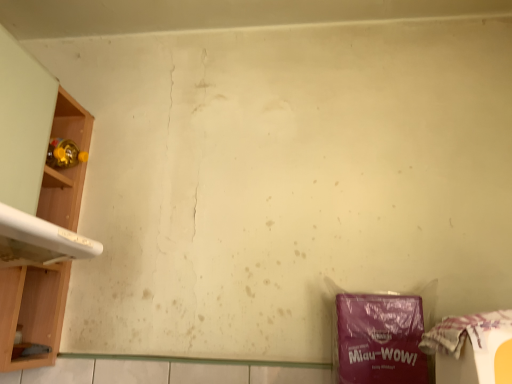
Question: Can you confirm if purple matte plastic bag at lower right is thinner than wooden shelf at left?

Choices:
 (A) no
 (B) yes

Answer: (B)

Question: Considering the relative positions of purple matte plastic bag at lower right and wooden shelf at left in the image provided, is purple matte plastic bag at lower right in front of wooden shelf at left?

Choices:
 (A) yes
 (B) no

Answer: (A)

Question: From a real-world perspective, is purple matte plastic bag at lower right below wooden shelf at left?

Choices:
 (A) no
 (B) yes

Answer: (B)

Question: From a real-world perspective, is purple matte plastic bag at lower right physically above wooden shelf at left?

Choices:
 (A) yes
 (B) no

Answer: (B)

Question: Is purple matte plastic bag at lower right oriented towards wooden shelf at left?

Choices:
 (A) no
 (B) yes

Answer: (A)

Question: Does purple matte plastic bag at lower right come behind wooden shelf at left?

Choices:
 (A) no
 (B) yes

Answer: (A)

Question: Is white glossy washing machine at left oriented towards purple matte plastic bag at lower right?

Choices:
 (A) yes
 (B) no

Answer: (A)

Question: From a real-world perspective, is white glossy washing machine at left positioned under purple matte plastic bag at lower right based on gravity?

Choices:
 (A) yes
 (B) no

Answer: (B)

Question: Does white glossy washing machine at left have a lesser width compared to purple matte plastic bag at lower right?

Choices:
 (A) no
 (B) yes

Answer: (A)

Question: Is white glossy washing machine at left to the left of purple matte plastic bag at lower right from the viewer's perspective?

Choices:
 (A) yes
 (B) no

Answer: (A)

Question: Considering the relative sizes of white glossy washing machine at left and purple matte plastic bag at lower right in the image provided, is white glossy washing machine at left smaller than purple matte plastic bag at lower right?

Choices:
 (A) yes
 (B) no

Answer: (B)

Question: Is white glossy washing machine at left at the right side of purple matte plastic bag at lower right?

Choices:
 (A) no
 (B) yes

Answer: (A)

Question: Considering the relative sizes of white glossy washing machine at left and plastic bag at lower right in the image provided, is white glossy washing machine at left thinner than plastic bag at lower right?

Choices:
 (A) no
 (B) yes

Answer: (A)